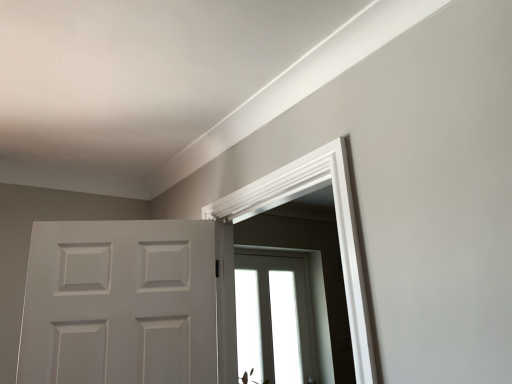
Question: From the image's perspective, would you say white matte door at center is positioned over transparent glass window at center?

Choices:
 (A) yes
 (B) no

Answer: (A)

Question: Could you tell me if white matte door at center is facing transparent glass window at center?

Choices:
 (A) yes
 (B) no

Answer: (B)

Question: Is white matte door at center shorter than transparent glass window at center?

Choices:
 (A) no
 (B) yes

Answer: (B)

Question: Is white matte door at center closer to the viewer compared to transparent glass window at center?

Choices:
 (A) yes
 (B) no

Answer: (A)

Question: Is white matte door at center looking in the opposite direction of transparent glass window at center?

Choices:
 (A) no
 (B) yes

Answer: (B)

Question: Would you say white matte door at center is to the left or to the right of transparent glass window at center in the picture?

Choices:
 (A) left
 (B) right

Answer: (A)

Question: Is white matte door at center taller or shorter than transparent glass window at center?

Choices:
 (A) tall
 (B) short

Answer: (B)

Question: Considering the positions of white matte door at center and transparent glass window at center in the image, is white matte door at center wider or thinner than transparent glass window at center?

Choices:
 (A) wide
 (B) thin

Answer: (A)

Question: Is white matte door at center inside or outside of transparent glass window at center?

Choices:
 (A) outside
 (B) inside

Answer: (A)

Question: In the image, is transparent glass window at center positioned in front of or behind white matte door at center?

Choices:
 (A) behind
 (B) front

Answer: (A)

Question: From the image's perspective, is transparent glass window at center located above or below white matte door at center?

Choices:
 (A) below
 (B) above

Answer: (A)

Question: Looking at their shapes, would you say transparent glass window at center is wider or thinner than white matte door at center?

Choices:
 (A) wide
 (B) thin

Answer: (B)

Question: Is transparent glass window at center spatially inside white matte door at center, or outside of it?

Choices:
 (A) inside
 (B) outside

Answer: (B)

Question: Which is correct: transparent glass window at center is inside white smooth door frame at upper center, or outside of it?

Choices:
 (A) outside
 (B) inside

Answer: (A)

Question: From the image's perspective, relative to white smooth door frame at upper center, is transparent glass window at center above or below?

Choices:
 (A) below
 (B) above

Answer: (A)